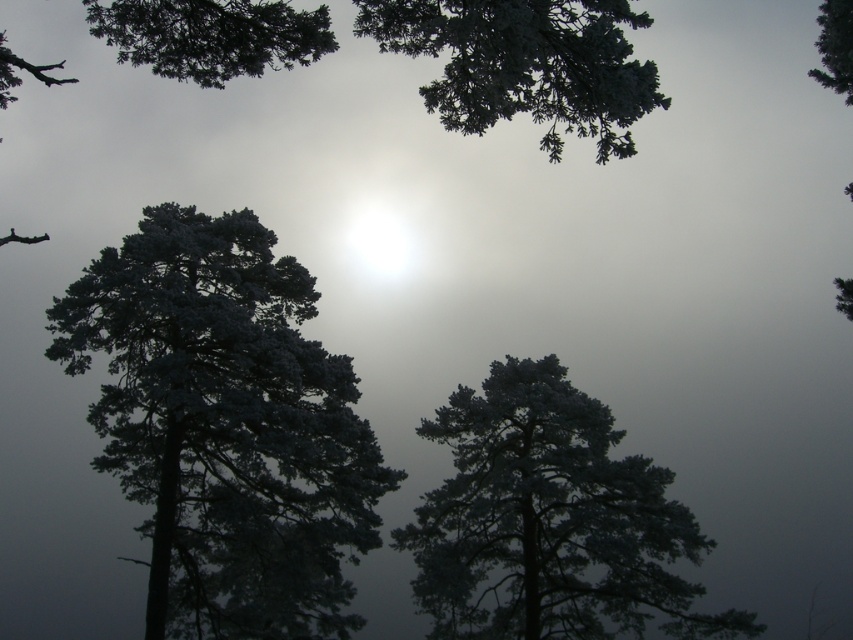
I want to click on snow-covered pine tree at center, so click(x=225, y=426).

Does point (164, 289) lie in front of point (606, 488)?

Yes, it is in front of point (606, 488).

Locate an element on the screen. snow-covered pine tree at center is located at coordinates (225, 426).

Does snowy pine tree at center appear on the left side of green matte tree at upper right?

Indeed, snowy pine tree at center is positioned on the left side of green matte tree at upper right.

Is point (639, 557) less distant than point (822, 44)?

Yes, point (639, 557) is closer to viewer.

Between point (630, 490) and point (833, 36), which one is positioned behind?

Point (630, 490)

Locate an element on the screen. The image size is (853, 640). snowy pine tree at center is located at coordinates (549, 522).

Between snow-covered pine tree at center and green matte tree at upper right, which one is positioned lower?

snow-covered pine tree at center is below.

Is point (113, 426) closer to viewer compared to point (844, 20)?

No, (113, 426) is further to viewer.

I want to click on snow-covered pine tree at center, so click(225, 426).